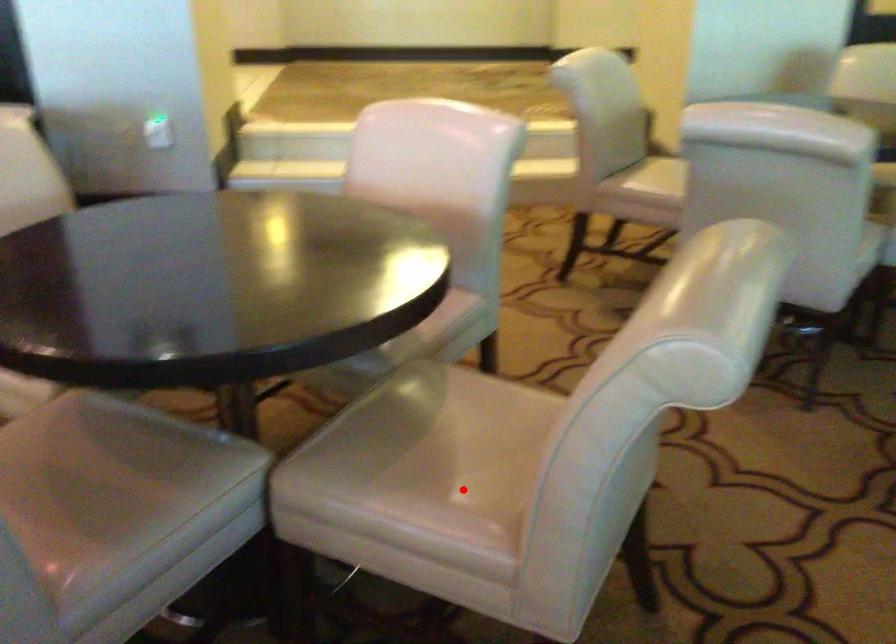
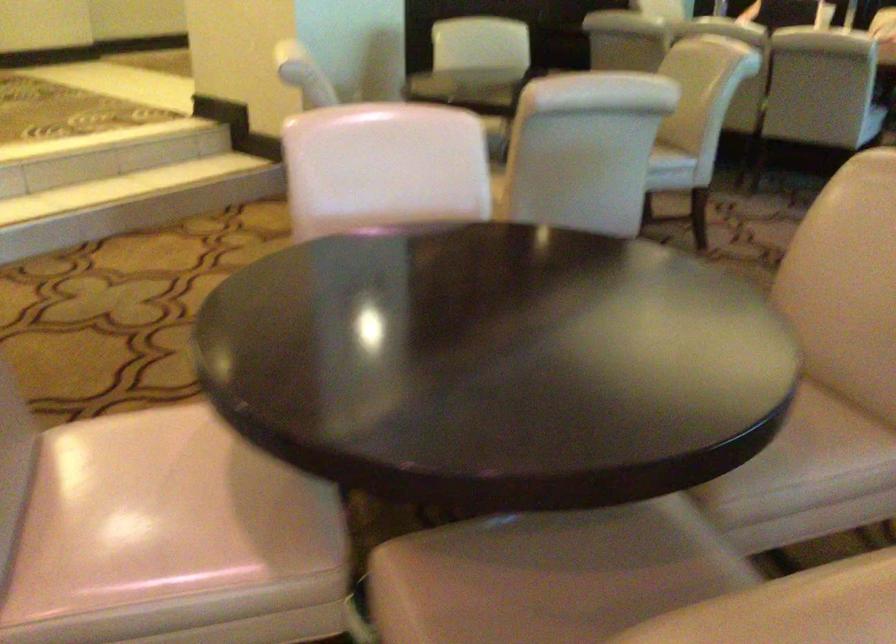
Question: I am providing you with two images of the same scene from different viewpoints. Image1 has a red point marked. In image2, the corresponding 3D location appears at what relative position? Reply with the corresponding letter.

Choices:
 (A) Closer
 (B) Farther

Answer: (B)